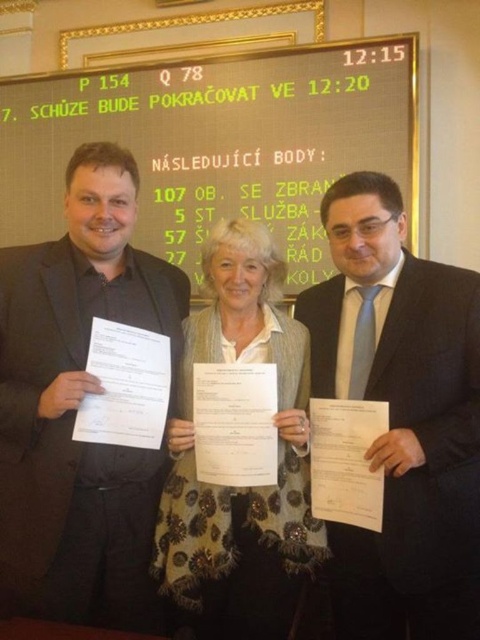
What are the coordinates of the dark suit at center?

The dark suit at center is located at coordinates point (402, 417).